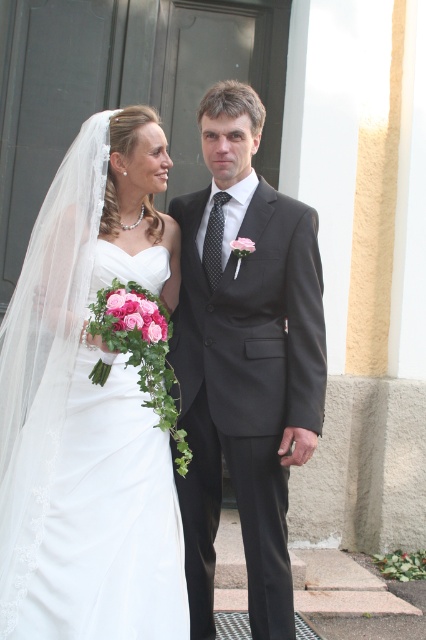
Based on the photo, which is more to the left, white satin dress at left or matte black suit at center?

Positioned to the left is white satin dress at left.

Consider the image. Can you confirm if white satin dress at left is positioned to the left of matte black suit at center?

Correct, you'll find white satin dress at left to the left of matte black suit at center.

Where is `white satin dress at left`? This screenshot has height=640, width=426. white satin dress at left is located at coordinates (88, 412).